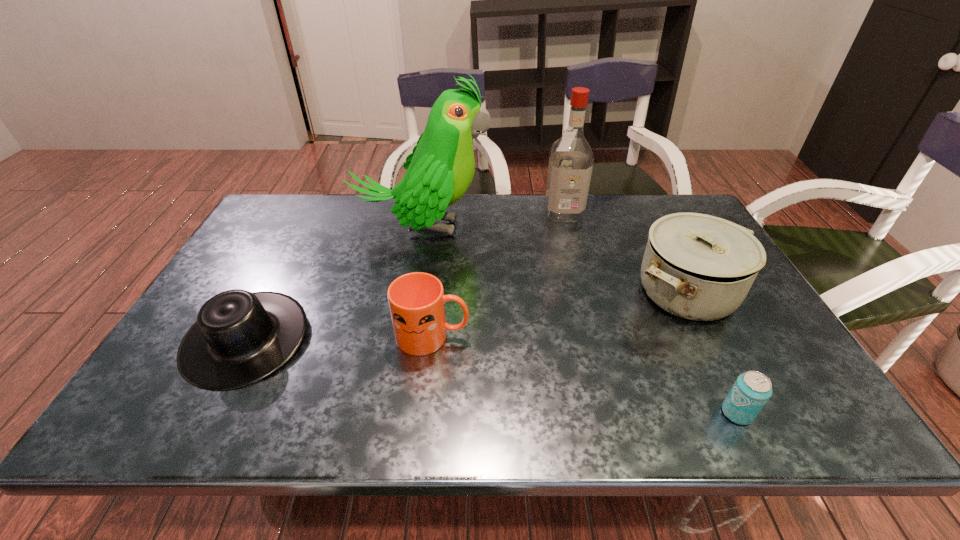
Where is `vacant space that satisfies the following two spatial constraints: 1. on the beak of the parakeet; 2. on the back side of the beer can`? The width and height of the screenshot is (960, 540). vacant space that satisfies the following two spatial constraints: 1. on the beak of the parakeet; 2. on the back side of the beer can is located at coordinates (391, 413).